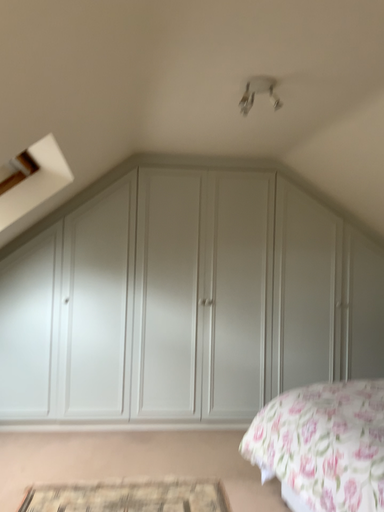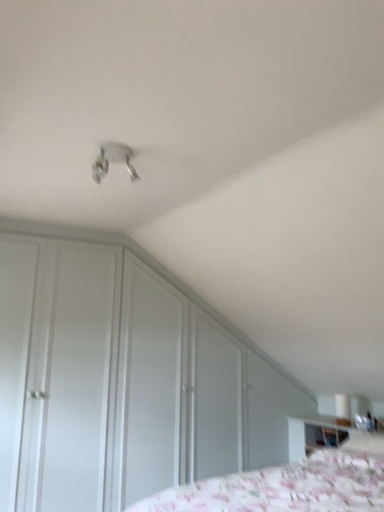
Question: How did the camera likely rotate when shooting the video?

Choices:
 (A) rotated right
 (B) rotated left

Answer: (A)